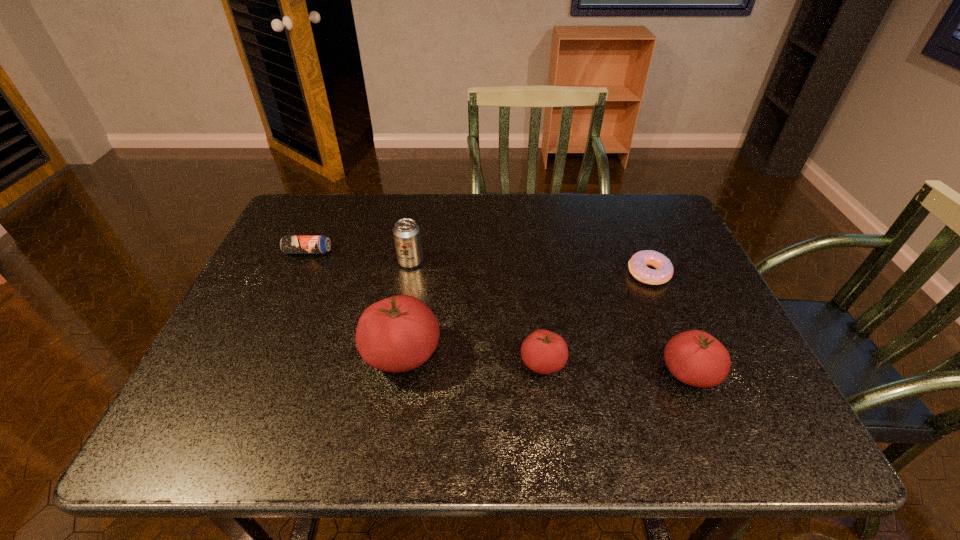
Where is `free area in between the left beer can and the tallest tomato`? free area in between the left beer can and the tallest tomato is located at coordinates (355, 303).

Image resolution: width=960 pixels, height=540 pixels. I want to click on free space between the doughnut and the shortest tomato, so click(x=596, y=319).

Point out which object is positioned as the second nearest to the taller beer can. Please provide its 2D coordinates. Your answer should be formatted as a tuple, i.e. [(x, y)], where the tuple contains the x and y coordinates of a point satisfying the conditions above.

[(289, 244)]

Identify which object is located as the third nearest to the doughnut. Please provide its 2D coordinates. Your answer should be formatted as a tuple, i.e. [(x, y)], where the tuple contains the x and y coordinates of a point satisfying the conditions above.

[(398, 334)]

Locate which tomato is the closest to the doughnut. Please provide its 2D coordinates. Your answer should be formatted as a tuple, i.e. [(x, y)], where the tuple contains the x and y coordinates of a point satisfying the conditions above.

[(696, 358)]

Locate an element on the screen. The width and height of the screenshot is (960, 540). tomato that stands as the closest to the right beer can is located at coordinates (398, 334).

This screenshot has height=540, width=960. In order to click on vacant space that satisfies the following two spatial constraints: 1. on the front side of the rightmost tomato; 2. on the right side of the shortest tomato in this screenshot , I will do `click(544, 373)`.

What are the coordinates of `free space that satisfies the following two spatial constraints: 1. on the front side of the taller beer can; 2. on the right side of the fourth object from left to right` in the screenshot? It's located at (393, 363).